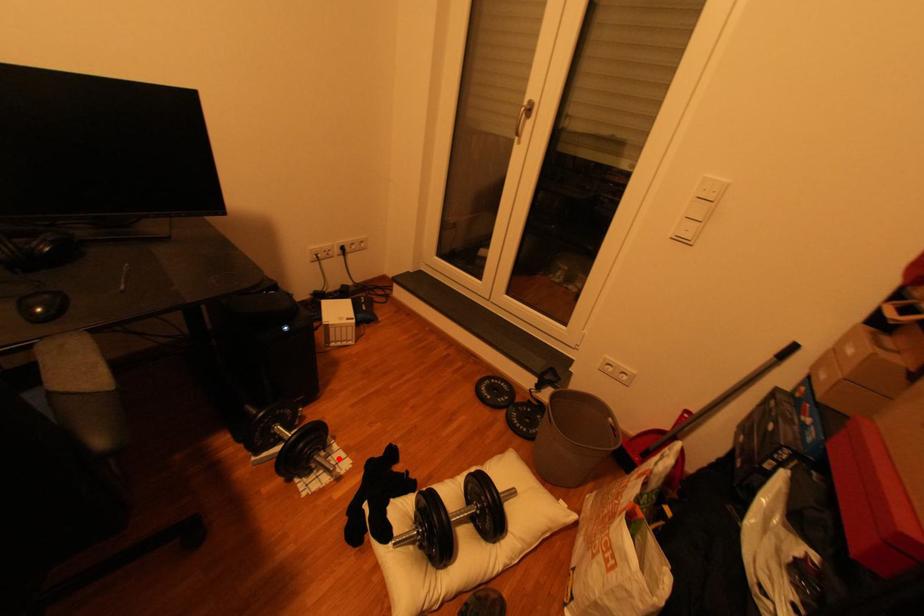
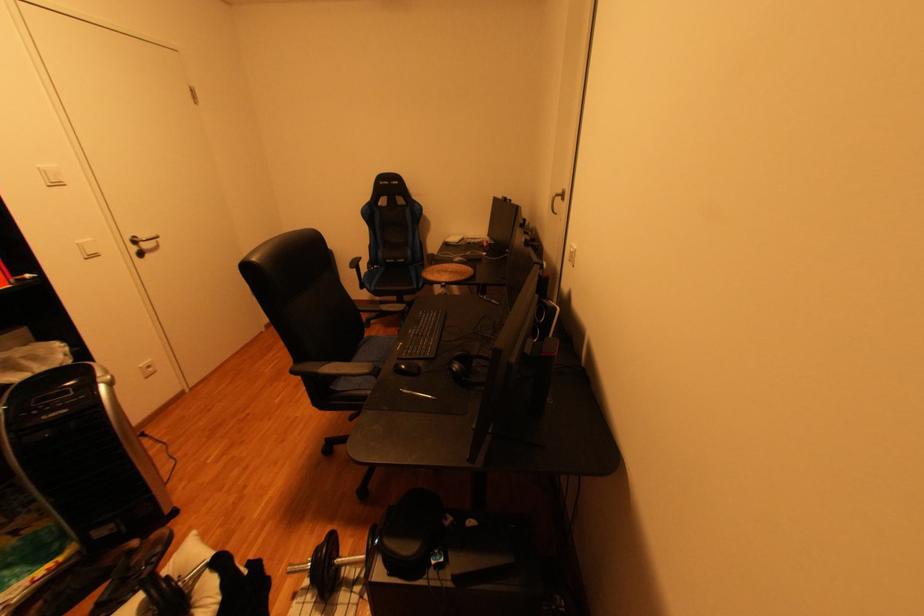
The point at the highlighted location is marked in the first image. Where is the corresponding point in the second image?

(323, 600)